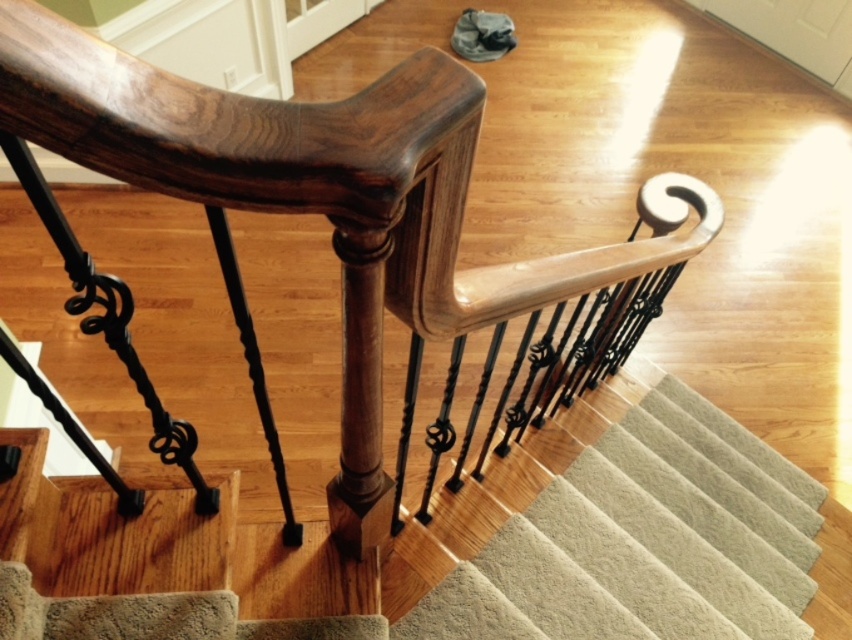
You are holding a 16 inch long tool and want to reach the glossy wood handrail at upper center from your current position. Can you reach it without moving closer?

The glossy wood handrail at upper center and camera are 18.53 inches apart. Since your tool is 16 inches long, you cannot reach it without moving closer.

You are standing at the bottom of the staircase and want to reach the top. You see two points marked on the staircase. The first point is at coordinate point (277, 129) and the second point is at coordinate point (752, 611). Which point is closer to you as you stand at the bottom?

Point (277, 129) is in front of point (752, 611), so it is closer to you as you stand at the bottom of the staircase.